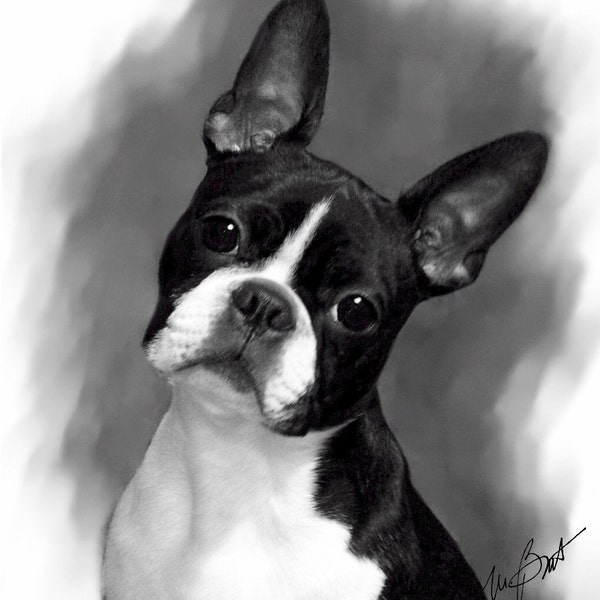
Where is `chest`? chest is located at coordinates (215, 535).